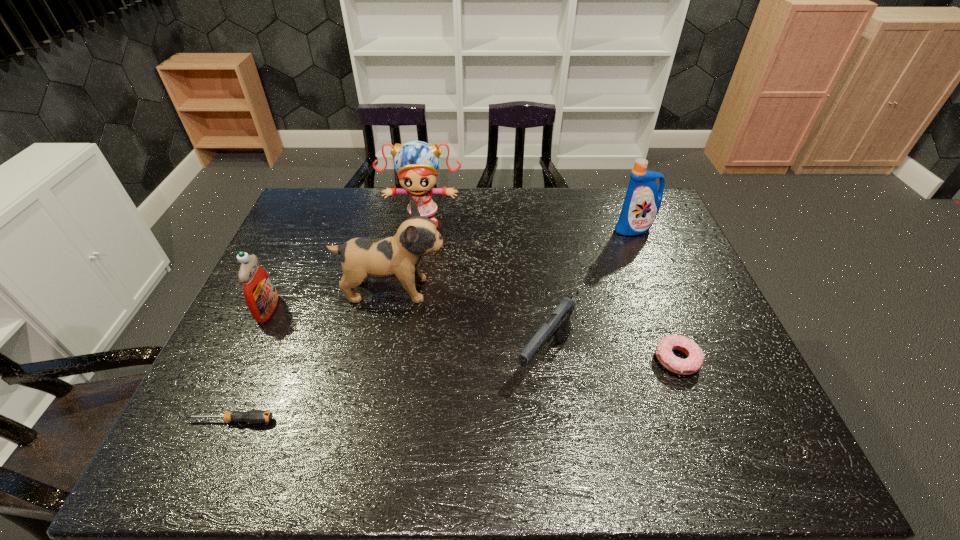
This screenshot has width=960, height=540. In order to click on detergent located in the left edge section of the desktop in this screenshot , I will do `click(261, 297)`.

Locate an element on the screen. screwdriver that is at the left edge is located at coordinates (253, 416).

This screenshot has width=960, height=540. Find the location of `detergent located at the right edge`. detergent located at the right edge is located at coordinates (642, 202).

This screenshot has width=960, height=540. What are the coordinates of `doughnut present at the right edge` in the screenshot? It's located at (695, 357).

Locate an element on the screen. This screenshot has height=540, width=960. object at the far right corner is located at coordinates (642, 202).

This screenshot has height=540, width=960. In the image, there is a desktop. Identify the location of free space at the far edge. (503, 215).

Find the location of a particular element. free point at the near edge is located at coordinates (555, 451).

In the image, there is a desktop. Identify the location of vacant area at the left edge. (256, 359).

Identify the location of vacant space at the right edge of the desktop. The width and height of the screenshot is (960, 540). (696, 291).

You are a GUI agent. You are given a task and a screenshot of the screen. Output one action in this format:
    pyautogui.click(x=<x>, y=<y>)
    Task: Click on the vacant area that lies between the shortest object and the puppy
    The image size is (960, 540).
    Given the screenshot: What is the action you would take?
    pyautogui.click(x=312, y=355)